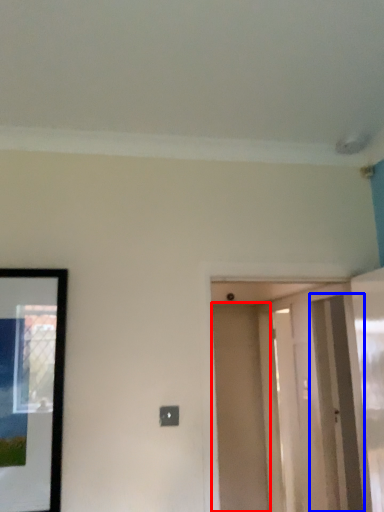
Question: Which point is closer to the camera, door (highlighted by a red box) or screen door (highlighted by a blue box)?

Choices:
 (A) door
 (B) screen door

Answer: (B)